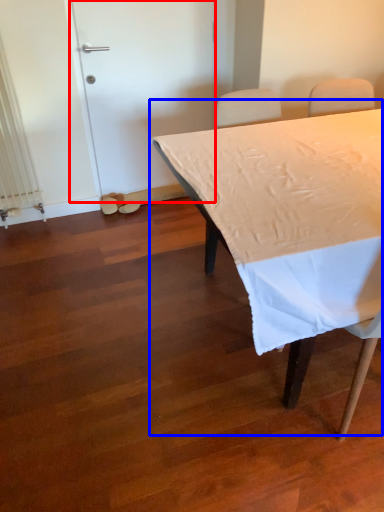
Question: Which object appears farthest to the camera in this image, door (highlighted by a red box) or table (highlighted by a blue box)?

Choices:
 (A) door
 (B) table

Answer: (A)